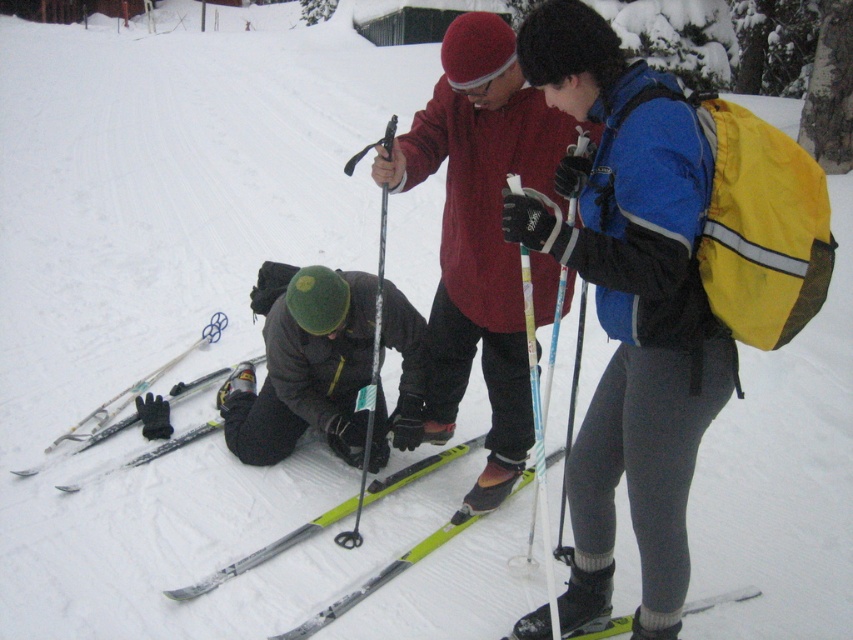
Question: Observing the image, what is the correct spatial positioning of silver metallic ski pole at center in reference to yellow matte ski at lower center?

Choices:
 (A) below
 (B) above

Answer: (B)

Question: Which of the following is the farthest from the observer?

Choices:
 (A) (376, 362)
 (B) (280, 433)
 (C) (718, 600)

Answer: (B)

Question: Can you confirm if matte red jacket at center is positioned below silver metallic ski pole at center?

Choices:
 (A) no
 (B) yes

Answer: (A)

Question: Which point is closer to the camera?

Choices:
 (A) (537, 497)
 (B) (735, 596)
 (C) (645, 157)
 (D) (401, 372)

Answer: (C)

Question: Does yellow backpack at center have a lesser width compared to yellow matte ski at lower center?

Choices:
 (A) yes
 (B) no

Answer: (A)

Question: Among these objects, which one is farthest from the camera?

Choices:
 (A) yellow matte ski at lower center
 (B) silver metallic ski pole at center
 (C) white plastic ski pole at center

Answer: (B)